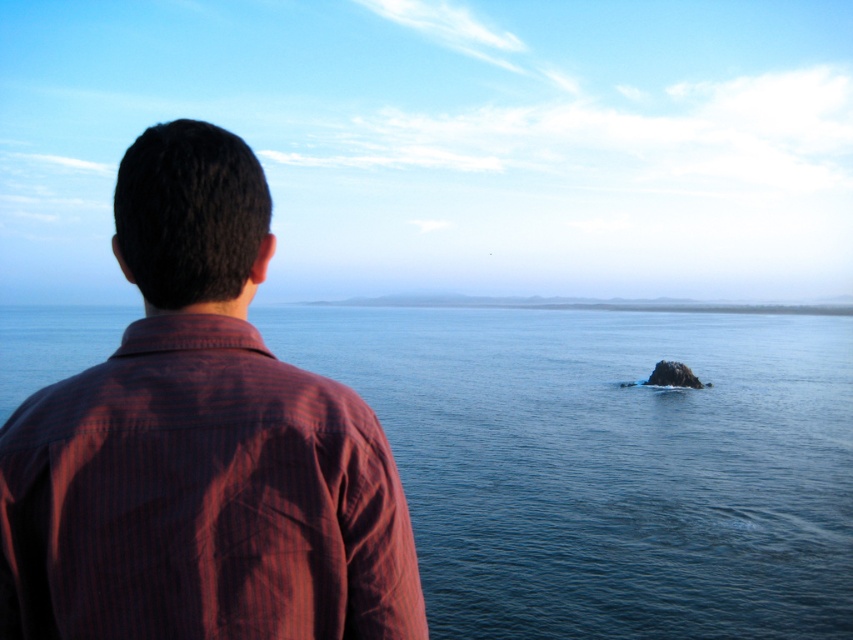
You are a photographer trying to capture the scene from the same vantage point as the person in the image. Based on the relative sizes of the blue water at center and the striped cotton shirt at upper left, which object would appear larger in your photo?

The blue water at center appears larger in the photo because it is taller than the striped cotton shirt at upper left.

You are standing at the water edge and want to reach the point marked at coordinates point (509, 420). If your walking speed is 3 feet per second, how many seconds will it take you to reach that point?

The distance between you and point (509, 420) is 135.93 feet. At a speed of 3 feet per second, dividing the distance by speed gives 135.93 divided by 3 equals approximately 45.31 seconds. So it will take about 45 seconds.